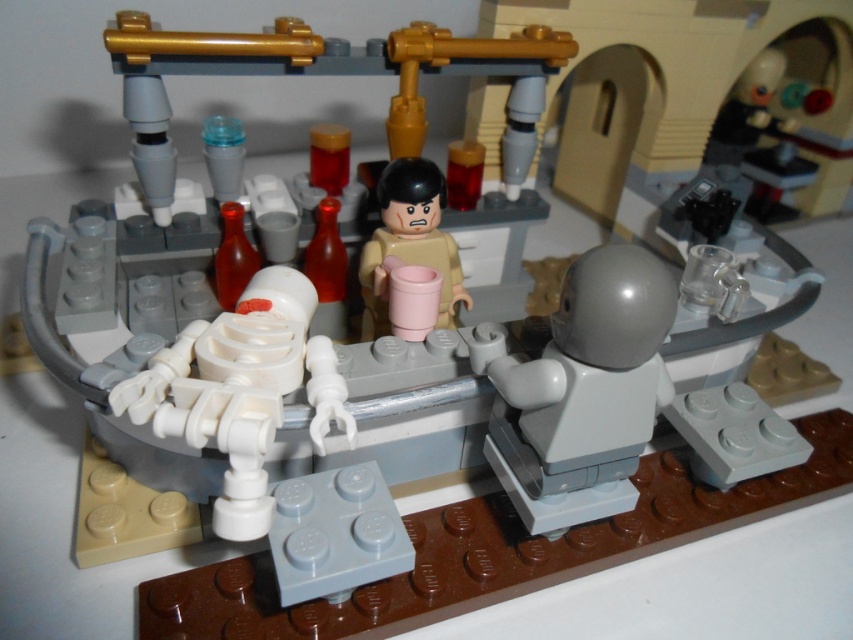
You are standing at the camera position looking at the Lego scene. There is a point marked at coordinates point (610, 493). If you want to place a small Lego brick exactly at that point, how far in centimeters should you move forward from your current position to reach it?

The point (610, 493) is 78.55 centimeters away from the camera. To place the Lego brick exactly at that point, you should move forward 78.55 centimeters from the camera position.

From the picture: You are a Lego figure standing in the laboratory scene. You see the gray matte astronaut helmet at center and the tan matte cup at center. Which object is positioned lower in the image?

The gray matte astronaut helmet at center is located below the tan matte cup at center, so it is positioned lower in the image.

You are a Lego figure standing at point (451, 237) and want to move to the other side of the room. There is an obstacle at point (639, 300). Can you walk around it without getting too close?

Point (639, 300) is closer to the camera than point (451, 237), so the obstacle is nearer to you. To avoid getting too close, you should move around it by going either left or right along the path that keeps you farther away from the obstacle.